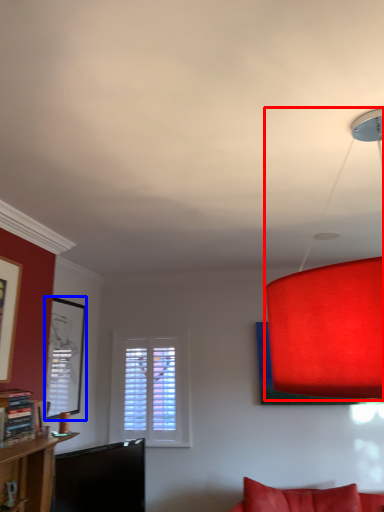
Question: Which point is further to the camera, lamp (highlighted by a red box) or picture frame (highlighted by a blue box)?

Choices:
 (A) lamp
 (B) picture frame

Answer: (B)